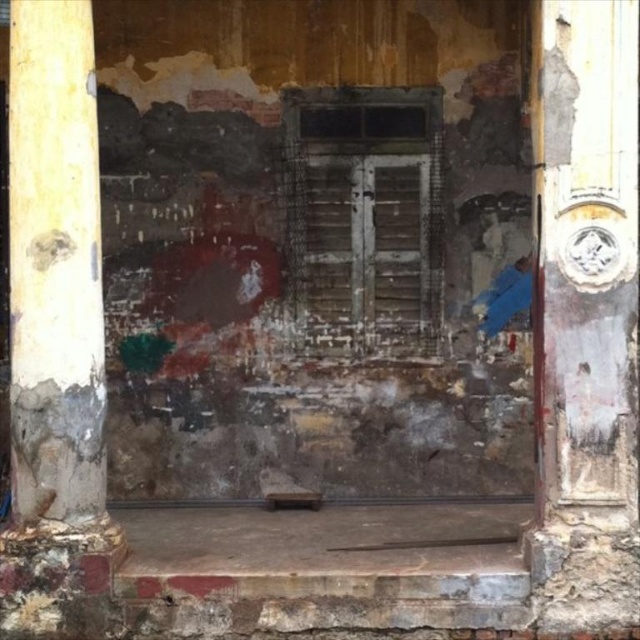
Does rusty metal door at right lie behind weathered wood pillar at left?

Yes, it is behind weathered wood pillar at left.

Is rusty metal door at right above weathered wood pillar at left?

Yes.

I want to click on rusty metal door at right, so click(x=584, y=314).

You are a GUI agent. You are given a task and a screenshot of the screen. Output one action in this format:
    pyautogui.click(x=<x>, y=<y>)
    Task: Click on the rusty metal door at right
    The width and height of the screenshot is (640, 640).
    Given the screenshot: What is the action you would take?
    pyautogui.click(x=584, y=314)